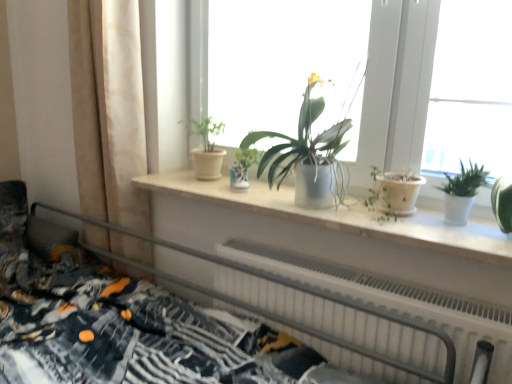
Where is `free space in front of matte white pot at center, the 1th houseplant from the left`? free space in front of matte white pot at center, the 1th houseplant from the left is located at coordinates (198, 185).